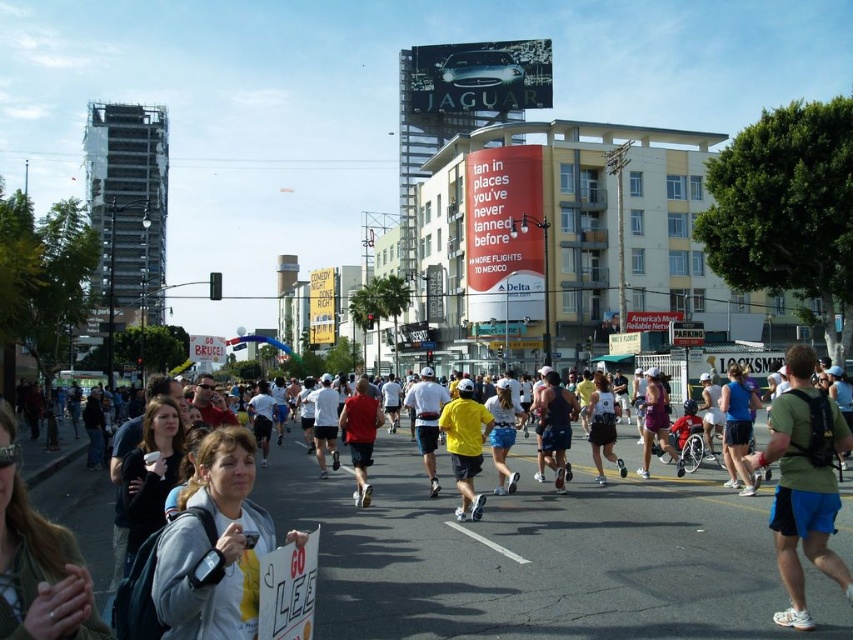
Question: Which object appears closest to the camera in this image?

Choices:
 (A) green fabric shirt at center
 (B) yellow matte shirt at center
 (C) white matte running shorts at center
 (D) matte purple shorts at center

Answer: (A)

Question: Which point is closer to the camera?

Choices:
 (A) white matte tank top at center
 (B) yellow t-shirt at center
 (C) red matte shirt at center

Answer: (C)

Question: Can you confirm if white cotton shirt at center is smaller than blue fabric shorts at center?

Choices:
 (A) no
 (B) yes

Answer: (B)

Question: Can you confirm if white cotton shirt at center is positioned to the right of white matte running shorts at center?

Choices:
 (A) no
 (B) yes

Answer: (A)

Question: Where is blue fabric shorts at center located in relation to white matte running shorts at center in the image?

Choices:
 (A) right
 (B) left

Answer: (A)

Question: Which point is closer to the camera taking this photo?

Choices:
 (A) (448, 442)
 (B) (404, 396)
 (C) (366, 412)

Answer: (A)